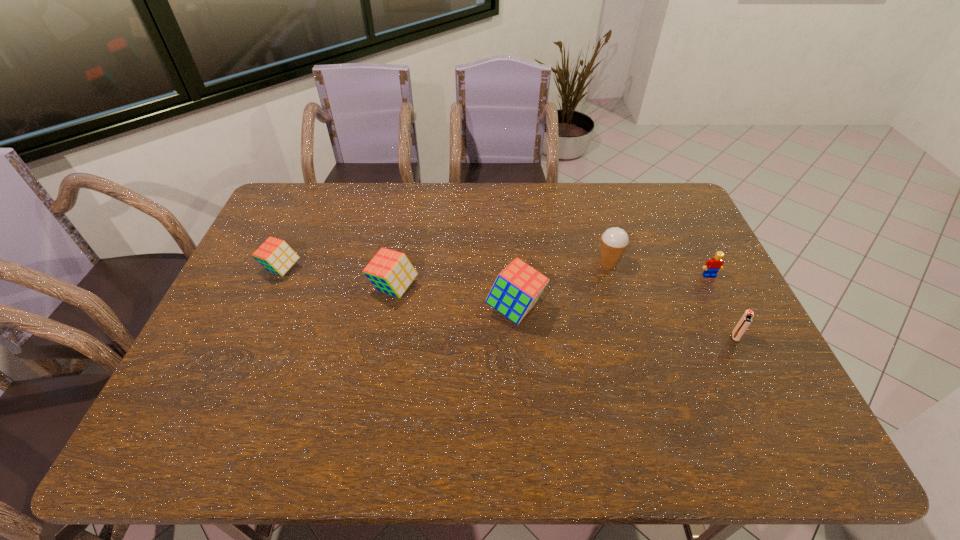
The image size is (960, 540). I want to click on free space at the far left corner of the desktop, so click(272, 212).

The height and width of the screenshot is (540, 960). I want to click on vacant space at the far right corner of the desktop, so click(687, 211).

This screenshot has height=540, width=960. In the image, there is a desktop. Identify the location of free space at the near right corner. (769, 406).

At what (x,y) coordinates should I click in order to perform the action: click on free area in between the icecream and the leftmost object. Please return your answer as a coordinate pair (x, y). This screenshot has width=960, height=540. Looking at the image, I should click on (445, 266).

In order to click on empty space between the rightmost cube and the second object from left to right in this screenshot , I will do `click(455, 298)`.

The width and height of the screenshot is (960, 540). I want to click on free space between the rightmost cube and the igniter, so click(x=626, y=322).

The width and height of the screenshot is (960, 540). I want to click on unoccupied position between the Lego and the nearest object, so click(x=722, y=306).

The width and height of the screenshot is (960, 540). I want to click on vacant space that is in between the second object from left to right and the shortest cube, so click(338, 279).

Image resolution: width=960 pixels, height=540 pixels. I want to click on vacant point located between the igniter and the Lego, so click(722, 306).

This screenshot has width=960, height=540. What are the coordinates of `vacant point located between the leftmost cube and the second cube from right to left` in the screenshot? It's located at (338, 279).